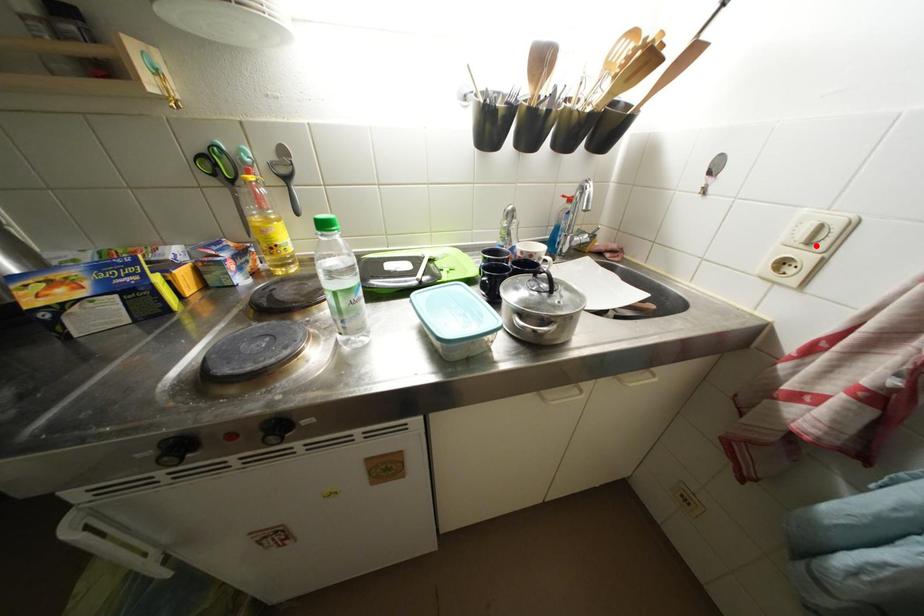
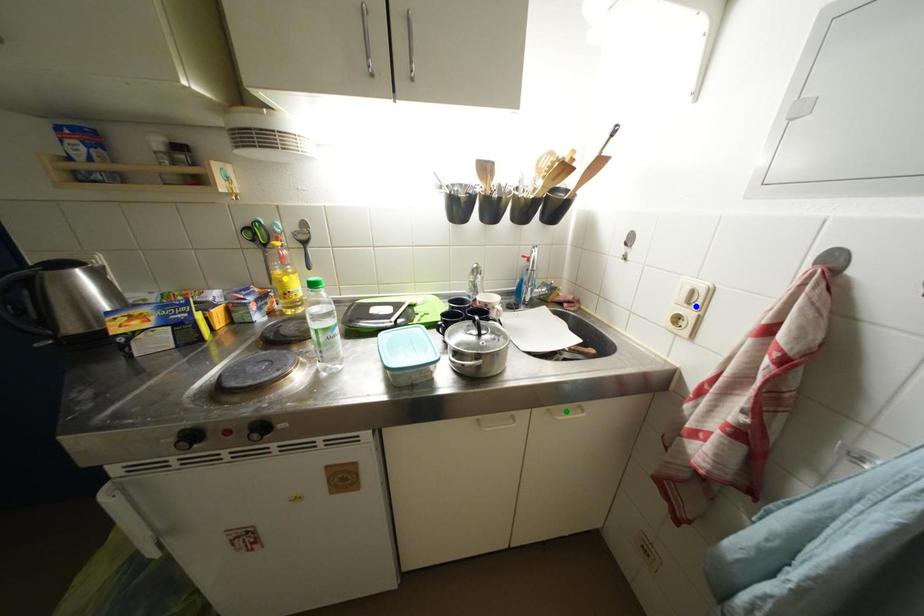
Question: I am providing you with two images of the same scene from different viewpoints. A red point is marked on the first image. You are given multiple points on the second image. Which point in image 2 represents the same 3d spot as the red point in image 1?

Choices:
 (A) yellow point
 (B) green point
 (C) blue point

Answer: (C)